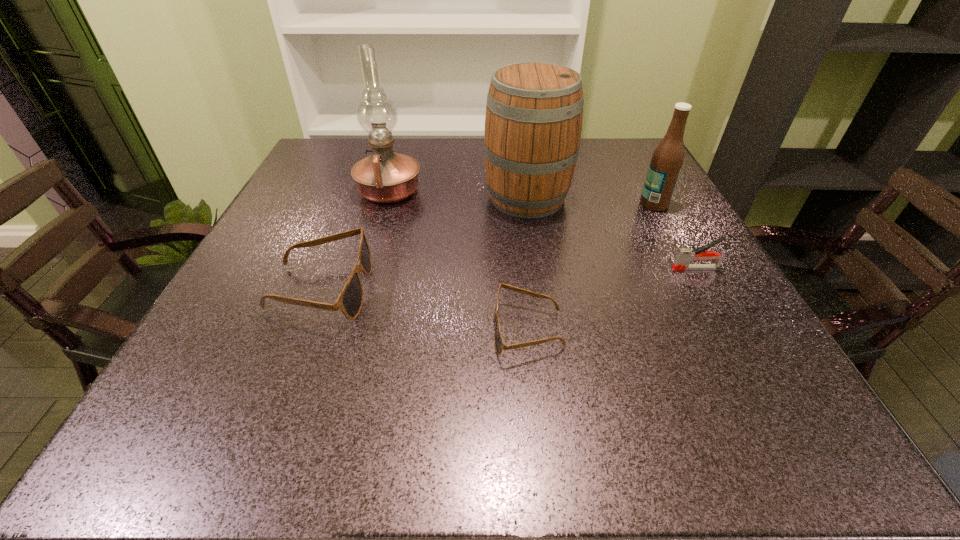
The image size is (960, 540). I want to click on vacant area that lies between the beer bottle and the taller sunglasses, so click(x=488, y=246).

Choose which object is the second nearest neighbor to the stapler. Please provide its 2D coordinates. Your answer should be formatted as a tuple, i.e. [(x, y)], where the tuple contains the x and y coordinates of a point satisfying the conditions above.

[(533, 123)]

Point out which object is positioned as the third nearest to the fourth shortest object. Please provide its 2D coordinates. Your answer should be formatted as a tuple, i.e. [(x, y)], where the tuple contains the x and y coordinates of a point satisfying the conditions above.

[(499, 344)]

Image resolution: width=960 pixels, height=540 pixels. What are the coordinates of `free point that satisfies the following two spatial constraints: 1. on the front side of the beer bottle; 2. on the right side of the oil lamp` in the screenshot? It's located at 385,204.

Find the location of a particular element. vacant space that satisfies the following two spatial constraints: 1. on the front side of the cider; 2. on the right side of the oil lamp is located at coordinates (387, 197).

At what (x,y) coordinates should I click in order to perform the action: click on vacant space that satisfies the following two spatial constraints: 1. on the front side of the second tallest object; 2. on the frames of the right sunglasses. Please return your answer as a coordinate pair (x, y). Looking at the image, I should click on (546, 330).